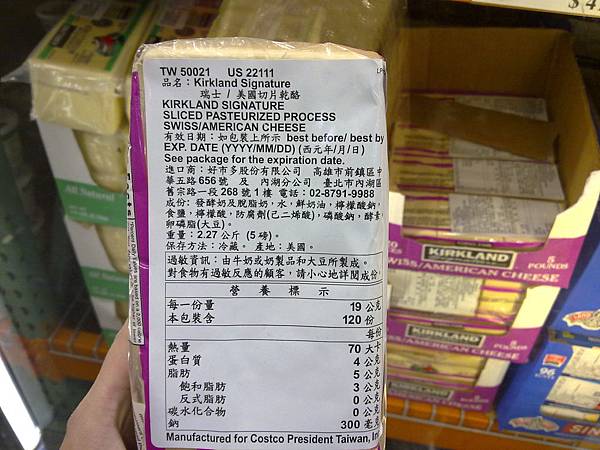
I want to click on 2 boxes with blue on it, so click(x=548, y=375), click(x=583, y=317).